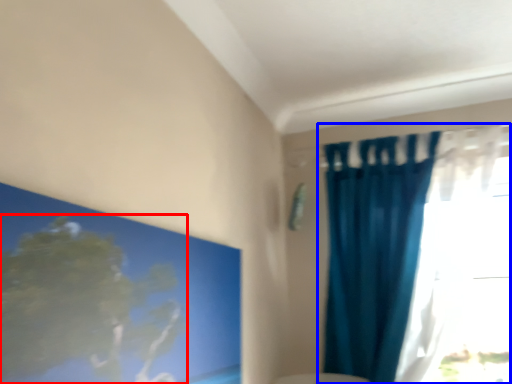
Question: Which object is further to the camera taking this photo, tree (highlighted by a red box) or curtain (highlighted by a blue box)?

Choices:
 (A) tree
 (B) curtain

Answer: (B)